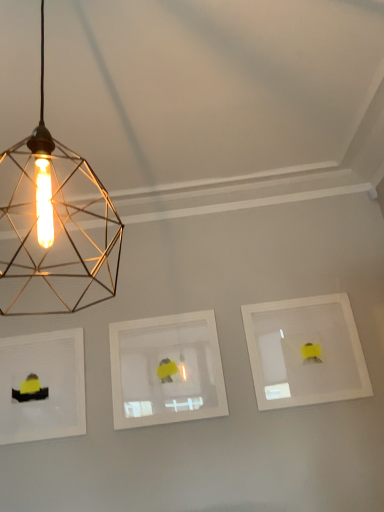
How much space does matte white picture frame at left, which ranks as the 3th picture frame in right-to-left order, occupy horizontally?

The width of matte white picture frame at left, which ranks as the 3th picture frame in right-to-left order, is 1.75 inches.

Locate an element on the screen. Image resolution: width=384 pixels, height=512 pixels. white matte picture frame at center, the 2th picture frame in the left-to-right sequence is located at coordinates (166, 370).

What do you see at coordinates (166, 370) in the screenshot? I see `white matte picture frame at center, the 2th picture frame in the left-to-right sequence` at bounding box center [166, 370].

Describe the element at coordinates (301, 354) in the screenshot. I see `white matte picture frame at right, positioned as the 3th picture frame in left-to-right order` at that location.

The height and width of the screenshot is (512, 384). What are the coordinates of `matte white picture frame at left, positioned as the 1th picture frame in left-to-right order` in the screenshot? It's located at (43, 385).

Is white matte picture frame at right, acting as the first picture frame starting from the right, taller than matte white picture frame at left, positioned as the 1th picture frame in left-to-right order?

Indeed, white matte picture frame at right, acting as the first picture frame starting from the right, has a greater height compared to matte white picture frame at left, positioned as the 1th picture frame in left-to-right order.

Which is closer, (304, 344) or (75, 408)?

The point (75, 408) is closer.

Is white matte picture frame at right, acting as the first picture frame starting from the right, next to matte white picture frame at left, which ranks as the 3th picture frame in right-to-left order?

No.

Considering their positions, is white matte picture frame at right, acting as the first picture frame starting from the right, located in front of or behind matte white picture frame at left, positioned as the 1th picture frame in left-to-right order?

white matte picture frame at right, acting as the first picture frame starting from the right, is positioned closer to the viewer than matte white picture frame at left, positioned as the 1th picture frame in left-to-right order.

Is point (329, 322) more distant than point (72, 234)?

Yes.

Based on the photo, is gold wire mesh light bulb at upper left at the back of white matte picture frame at right, acting as the first picture frame starting from the right?

No, white matte picture frame at right, acting as the first picture frame starting from the right, is not facing the opposite direction of gold wire mesh light bulb at upper left.

Considering the relative positions of white matte picture frame at right, acting as the first picture frame starting from the right, and gold wire mesh light bulb at upper left in the image provided, is white matte picture frame at right, acting as the first picture frame starting from the right, behind gold wire mesh light bulb at upper left?

Yes, white matte picture frame at right, acting as the first picture frame starting from the right, is further from the viewer.

Considering the sizes of objects matte white picture frame at left, positioned as the 1th picture frame in left-to-right order, and white matte picture frame at right, acting as the first picture frame starting from the right, in the image provided, who is smaller, matte white picture frame at left, positioned as the 1th picture frame in left-to-right order, or white matte picture frame at right, acting as the first picture frame starting from the right,?

With smaller size is matte white picture frame at left, positioned as the 1th picture frame in left-to-right order.

Is matte white picture frame at left, which ranks as the 3th picture frame in right-to-left order, taller or shorter than white matte picture frame at right, acting as the first picture frame starting from the right?

In the image, matte white picture frame at left, which ranks as the 3th picture frame in right-to-left order, appears to be shorter than white matte picture frame at right, acting as the first picture frame starting from the right.

From the image's perspective, would you say matte white picture frame at left, which ranks as the 3th picture frame in right-to-left order, is shown under white matte picture frame at right, acting as the first picture frame starting from the right?

Correct, matte white picture frame at left, which ranks as the 3th picture frame in right-to-left order, appears lower than white matte picture frame at right, acting as the first picture frame starting from the right, in the image.

From a real-world perspective, is matte white picture frame at left, which ranks as the 3th picture frame in right-to-left order, over white matte picture frame at right, acting as the first picture frame starting from the right?

No, from a real-world perspective, matte white picture frame at left, which ranks as the 3th picture frame in right-to-left order, is not on top of white matte picture frame at right, acting as the first picture frame starting from the right.

Based on the photo, considering the relative positions of white matte picture frame at center, the second picture frame in the right-to-left sequence, and white matte picture frame at right, acting as the first picture frame starting from the right, in the image provided, is white matte picture frame at center, the second picture frame in the right-to-left sequence, to the left of white matte picture frame at right, acting as the first picture frame starting from the right, from the viewer's perspective?

Indeed, white matte picture frame at center, the second picture frame in the right-to-left sequence, is positioned on the left side of white matte picture frame at right, acting as the first picture frame starting from the right.

In the scene shown: From a real-world perspective, is white matte picture frame at center, the 2th picture frame in the left-to-right sequence, below white matte picture frame at right, positioned as the 3th picture frame in left-to-right order?

Yes, from a real-world perspective, white matte picture frame at center, the 2th picture frame in the left-to-right sequence, is below white matte picture frame at right, positioned as the 3th picture frame in left-to-right order.

Would you say white matte picture frame at center, the 2th picture frame in the left-to-right sequence, contains white matte picture frame at right, acting as the first picture frame starting from the right?

No, white matte picture frame at right, acting as the first picture frame starting from the right, is located outside of white matte picture frame at center, the 2th picture frame in the left-to-right sequence.

Find the location of a particular element. This screenshot has height=512, width=384. the 1st picture frame behind the white matte picture frame at right, acting as the first picture frame starting from the right is located at coordinates (166, 370).

Which is more to the left, gold wire mesh light bulb at upper left or matte white picture frame at left, positioned as the 1th picture frame in left-to-right order?

matte white picture frame at left, positioned as the 1th picture frame in left-to-right order.

From the image's perspective, which one is positioned lower, gold wire mesh light bulb at upper left or matte white picture frame at left, positioned as the 1th picture frame in left-to-right order?

matte white picture frame at left, positioned as the 1th picture frame in left-to-right order, is shown below in the image.

Is gold wire mesh light bulb at upper left smaller than matte white picture frame at left, positioned as the 1th picture frame in left-to-right order?

No.

Which object is closer to the camera taking this photo, gold wire mesh light bulb at upper left or white matte picture frame at right, positioned as the 3th picture frame in left-to-right order?

gold wire mesh light bulb at upper left is in front.

Could you tell me if gold wire mesh light bulb at upper left is turned towards white matte picture frame at right, acting as the first picture frame starting from the right?

No, gold wire mesh light bulb at upper left is not facing towards white matte picture frame at right, acting as the first picture frame starting from the right.

Is gold wire mesh light bulb at upper left bigger than white matte picture frame at right, positioned as the 3th picture frame in left-to-right order?

Indeed, gold wire mesh light bulb at upper left has a larger size compared to white matte picture frame at right, positioned as the 3th picture frame in left-to-right order.

The height and width of the screenshot is (512, 384). Identify the location of the 1st picture frame directly above the matte white picture frame at left, which ranks as the 3th picture frame in right-to-left order (from a real-world perspective). (166, 370).

From a real-world perspective, which object stands above the other?

white matte picture frame at center, the 2th picture frame in the left-to-right sequence.

Which is farther, (128,365) or (62,436)?

The point (128,365) is more distant.

Considering the positions of objects white matte picture frame at center, the 2th picture frame in the left-to-right sequence, and matte white picture frame at left, which ranks as the 3th picture frame in right-to-left order, in the image provided, who is more to the right, white matte picture frame at center, the 2th picture frame in the left-to-right sequence, or matte white picture frame at left, which ranks as the 3th picture frame in right-to-left order,?

From the viewer's perspective, white matte picture frame at center, the 2th picture frame in the left-to-right sequence, appears more on the right side.

At what (x,y) coordinates should I click in order to perform the action: click on the 2nd picture frame above the matte white picture frame at left, which ranks as the 3th picture frame in right-to-left order (from the image's perspective). Please return your answer as a coordinate pair (x, y). The height and width of the screenshot is (512, 384). Looking at the image, I should click on (301, 354).

Locate an element on the screen. Image resolution: width=384 pixels, height=512 pixels. lamp on the left of white matte picture frame at right, acting as the first picture frame starting from the right is located at coordinates (54, 226).

From the image, which object appears to be nearer to matte white picture frame at left, positioned as the 1th picture frame in left-to-right order, white matte picture frame at right, acting as the first picture frame starting from the right, or white matte picture frame at center, the second picture frame in the right-to-left sequence?

white matte picture frame at center, the second picture frame in the right-to-left sequence.

From the image, which object appears to be farther from gold wire mesh light bulb at upper left, matte white picture frame at left, which ranks as the 3th picture frame in right-to-left order, or white matte picture frame at right, acting as the first picture frame starting from the right?

The object further to gold wire mesh light bulb at upper left is white matte picture frame at right, acting as the first picture frame starting from the right.

Estimate the real-world distances between objects in this image. Which object is further from gold wire mesh light bulb at upper left, white matte picture frame at right, positioned as the 3th picture frame in left-to-right order, or white matte picture frame at center, the second picture frame in the right-to-left sequence?

white matte picture frame at right, positioned as the 3th picture frame in left-to-right order.

Looking at the image, which one is located further to white matte picture frame at center, the 2th picture frame in the left-to-right sequence, white matte picture frame at right, acting as the first picture frame starting from the right, or matte white picture frame at left, positioned as the 1th picture frame in left-to-right order?

The object further to white matte picture frame at center, the 2th picture frame in the left-to-right sequence, is white matte picture frame at right, acting as the first picture frame starting from the right.

In the scene shown: From the image, which object appears to be farther from white matte picture frame at right, positioned as the 3th picture frame in left-to-right order, gold wire mesh light bulb at upper left or white matte picture frame at center, the 2th picture frame in the left-to-right sequence?

gold wire mesh light bulb at upper left is further to white matte picture frame at right, positioned as the 3th picture frame in left-to-right order.

Based on their spatial positions, is white matte picture frame at center, the 2th picture frame in the left-to-right sequence, or matte white picture frame at left, positioned as the 1th picture frame in left-to-right order, closer to white matte picture frame at right, positioned as the 3th picture frame in left-to-right order?

white matte picture frame at center, the 2th picture frame in the left-to-right sequence, is closer to white matte picture frame at right, positioned as the 3th picture frame in left-to-right order.

When comparing their distances from white matte picture frame at right, positioned as the 3th picture frame in left-to-right order, does matte white picture frame at left, which ranks as the 3th picture frame in right-to-left order, or gold wire mesh light bulb at upper left seem closer?

Among the two, gold wire mesh light bulb at upper left is located nearer to white matte picture frame at right, positioned as the 3th picture frame in left-to-right order.

When comparing their distances from white matte picture frame at center, the 2th picture frame in the left-to-right sequence, does gold wire mesh light bulb at upper left or matte white picture frame at left, positioned as the 1th picture frame in left-to-right order, seem further?

The object further to white matte picture frame at center, the 2th picture frame in the left-to-right sequence, is gold wire mesh light bulb at upper left.

Identify the location of picture frame positioned between gold wire mesh light bulb at upper left and white matte picture frame at center, the second picture frame in the right-to-left sequence, from near to far. This screenshot has height=512, width=384. (301, 354).

You are a GUI agent. You are given a task and a screenshot of the screen. Output one action in this format:
    pyautogui.click(x=<x>, y=<y>)
    Task: Click on the picture frame between matte white picture frame at left, positioned as the 1th picture frame in left-to-right order, and white matte picture frame at right, acting as the first picture frame starting from the right
    This screenshot has width=384, height=512.
    Given the screenshot: What is the action you would take?
    pyautogui.click(x=166, y=370)